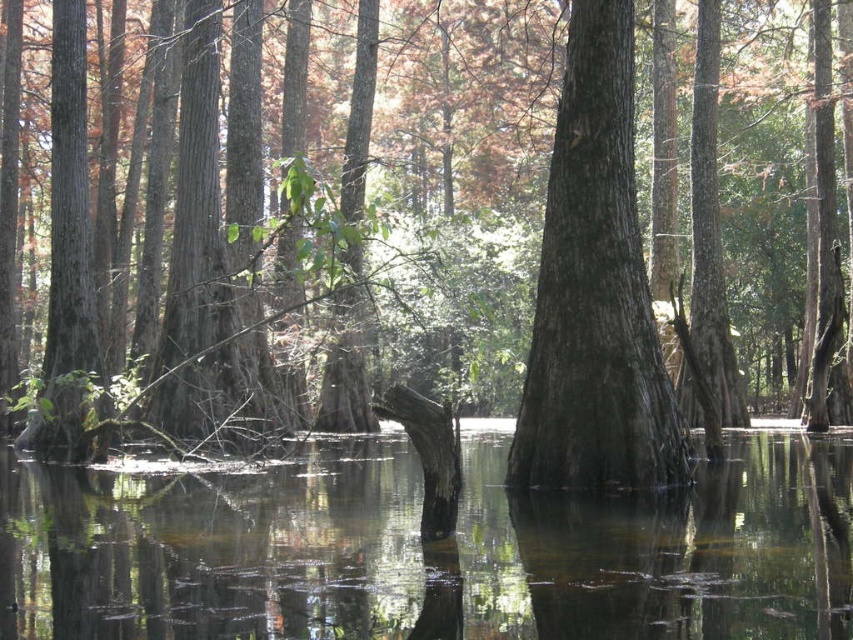
You are standing on a wooden path that runs along the edge of the swamp. You see the clear water at center and the smooth dark brown tree trunk at center. Which one is wider from your perspective?

The clear water at center is wider than the smooth dark brown tree trunk at center from your perspective.

You are a kayaker in the swamp. Your kayak is 2 meters long. You want to paddle between the clear water at center and the smooth dark brown tree trunk at center. Can your kayak fit through the space between them?

The clear water at center is 4.35 meters away from the smooth dark brown tree trunk at center. Since your kayak is only 2 meters long, it can easily fit through the space between them as the distance is more than double the kayak length.